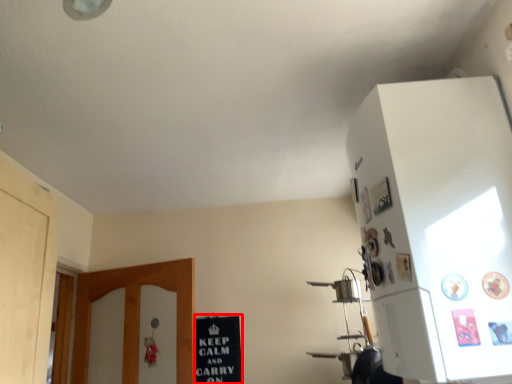
Question: From the image's perspective, where is bulletin board (annotated by the red box) located relative to cabinetry?

Choices:
 (A) above
 (B) below

Answer: (B)